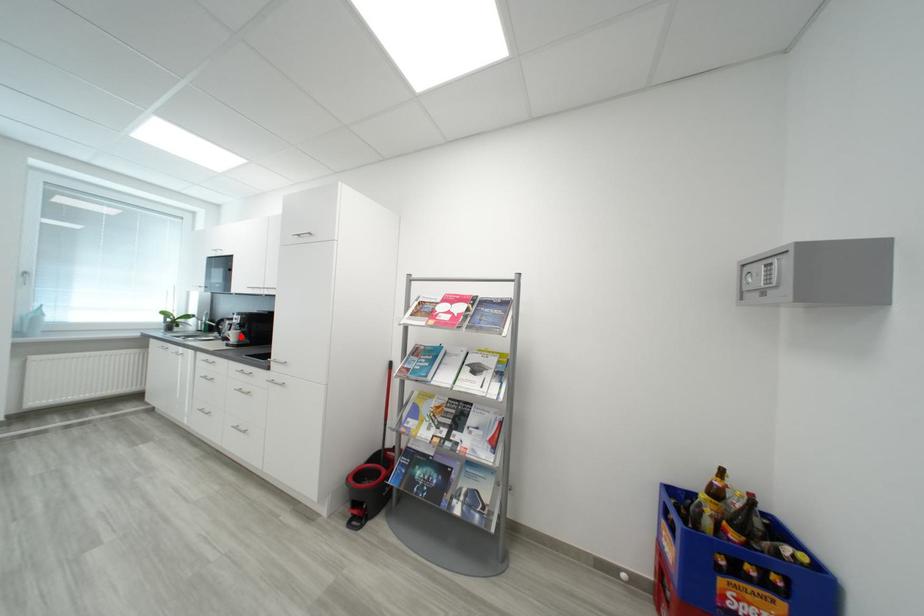
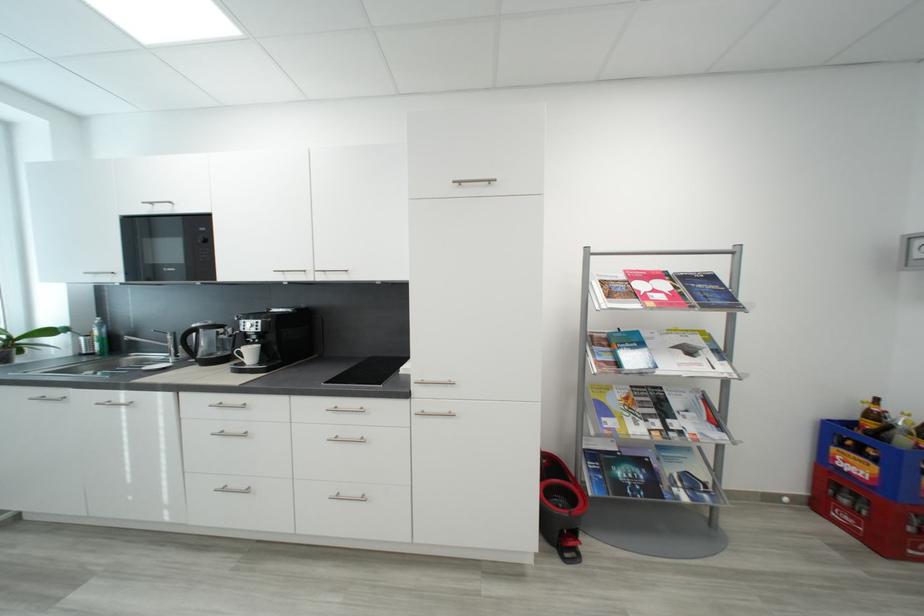
Find the pixel in the second image that matches the highlighted location in the first image.

(257, 354)